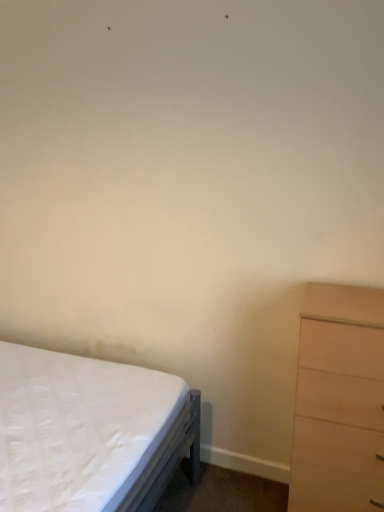
Question: In the image, is white quilted mattress at lower left positioned in front of or behind light brown wood chest of drawers at right?

Choices:
 (A) front
 (B) behind

Answer: (A)

Question: From the image's perspective, is white quilted mattress at lower left positioned above or below light brown wood chest of drawers at right?

Choices:
 (A) above
 (B) below

Answer: (B)

Question: Considering the positions of white quilted mattress at lower left and light brown wood chest of drawers at right in the image, is white quilted mattress at lower left wider or thinner than light brown wood chest of drawers at right?

Choices:
 (A) thin
 (B) wide

Answer: (B)

Question: Is light brown wood chest of drawers at right inside the boundaries of white quilted mattress at lower left, or outside?

Choices:
 (A) outside
 (B) inside

Answer: (A)

Question: In terms of height, does light brown wood chest of drawers at right look taller or shorter compared to white quilted mattress at lower left?

Choices:
 (A) short
 (B) tall

Answer: (B)

Question: Considering the positions of light brown wood chest of drawers at right and white quilted mattress at lower left in the image, is light brown wood chest of drawers at right wider or thinner than white quilted mattress at lower left?

Choices:
 (A) wide
 (B) thin

Answer: (B)

Question: Considering their positions, is light brown wood chest of drawers at right located in front of or behind white quilted mattress at lower left?

Choices:
 (A) behind
 (B) front

Answer: (A)